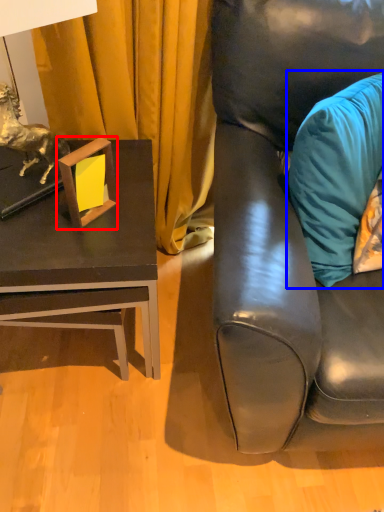
Question: Which point is closer to the camera, picture frame (highlighted by a red box) or pillow (highlighted by a blue box)?

Choices:
 (A) picture frame
 (B) pillow

Answer: (B)